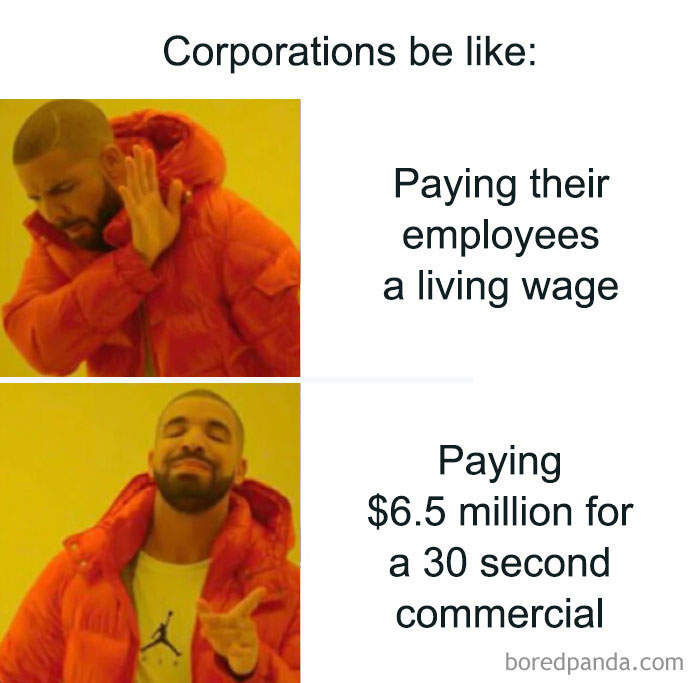
Locate an element on the screen. This screenshot has width=700, height=683. coat is located at coordinates (197, 266), (239, 540).